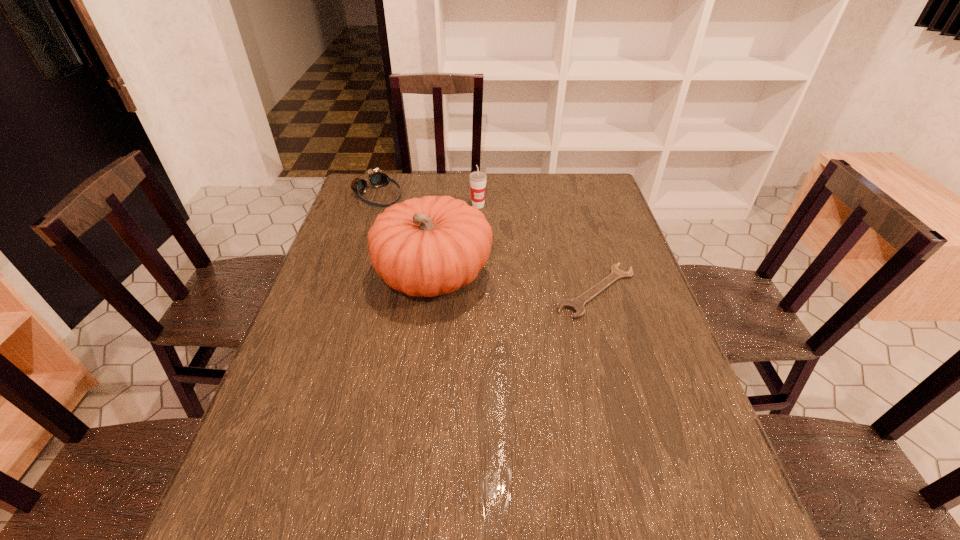
Find the location of a particular element. The height and width of the screenshot is (540, 960). vacant space situated 0.230m through the lenses of the second shortest object is located at coordinates (435, 234).

At what (x,y) coordinates should I click in order to perform the action: click on free space located through the lenses of the second shortest object. Please return your answer as a coordinate pair (x, y). The height and width of the screenshot is (540, 960). Looking at the image, I should click on (461, 251).

At what (x,y) coordinates should I click in order to perform the action: click on free location located 0.320m through the lenses of the second shortest object. Please return your answer as a coordinate pair (x, y). Looking at the image, I should click on (454, 247).

At what (x,y) coordinates should I click in order to perform the action: click on cup present at the far edge. Please return your answer as a coordinate pair (x, y). Image resolution: width=960 pixels, height=540 pixels. Looking at the image, I should click on (477, 178).

Find the location of a particular element. The image size is (960, 540). goggles at the far edge is located at coordinates (377, 179).

You are a GUI agent. You are given a task and a screenshot of the screen. Output one action in this format:
    pyautogui.click(x=<x>, y=<y>)
    Task: Click on the object that is at the left edge
    The height and width of the screenshot is (540, 960).
    Given the screenshot: What is the action you would take?
    pyautogui.click(x=377, y=179)

Identify the location of object that is positioned at the right edge. The image size is (960, 540). (576, 304).

The height and width of the screenshot is (540, 960). What are the coordinates of `object present at the far left corner` in the screenshot? It's located at (377, 179).

In the image, there is a desktop. Identify the location of free space at the far edge. The height and width of the screenshot is (540, 960). (407, 183).

The width and height of the screenshot is (960, 540). Find the location of `vacant region at the near edge`. vacant region at the near edge is located at coordinates pos(388,460).